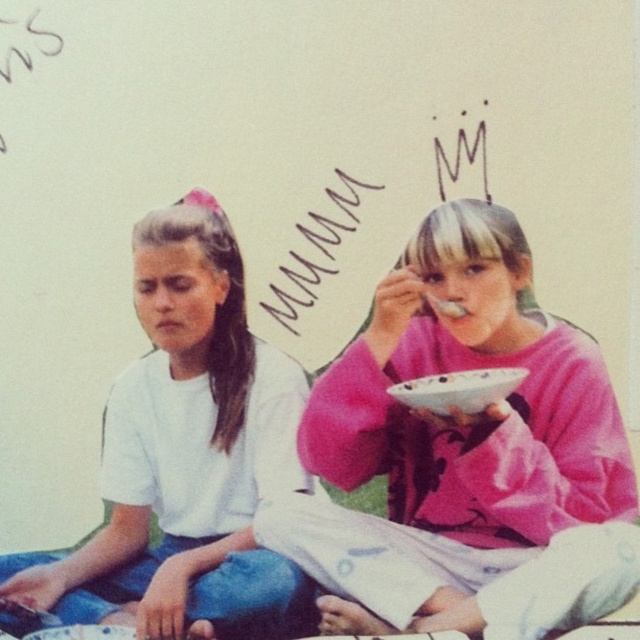
Is pink matte sweater at upper right wider than handwritten text at upper center?

Yes, pink matte sweater at upper right is wider than handwritten text at upper center.

Find the location of `pink matte sweater at upper right`. pink matte sweater at upper right is located at coordinates pos(451,436).

Is pink matte sweater at upper right wider than white matte shirt at left?

Indeed, pink matte sweater at upper right has a greater width compared to white matte shirt at left.

In order to click on pink matte sweater at upper right in this screenshot , I will do click(x=451, y=436).

Is point (195, 595) positioned before point (346, 298)?

Yes.

Does white matte shirt at left have a greater height compared to handwritten text at upper center?

Correct, white matte shirt at left is much taller as handwritten text at upper center.

Is point (275, 577) positioned after point (452, 156)?

No, (275, 577) is in front of (452, 156).

Locate an element on the screen. This screenshot has width=640, height=640. white matte shirt at left is located at coordinates (182, 451).